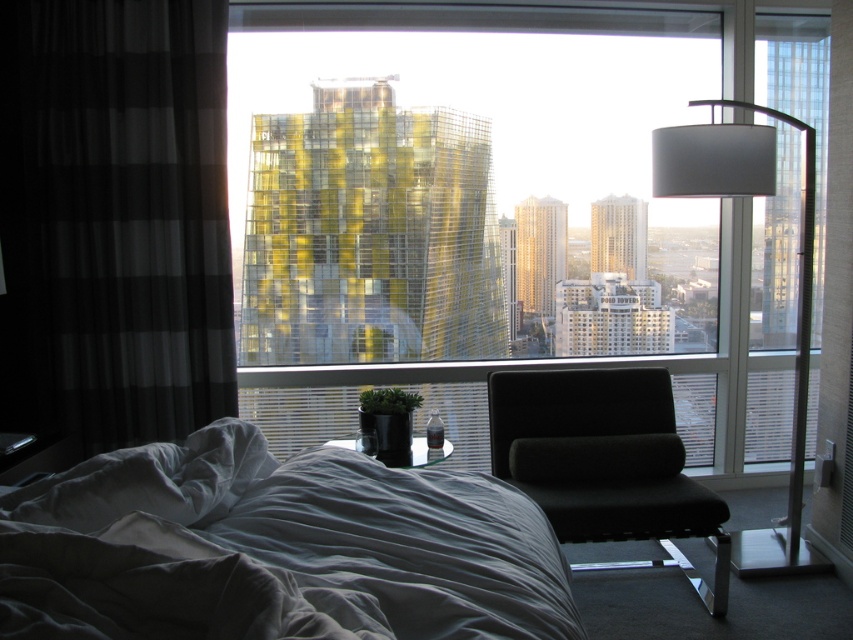
Question: Which point is closer to the camera?

Choices:
 (A) black checkered curtain at left
 (B) matte gray lamp at right
 (C) gray cotton bed at lower left

Answer: (C)

Question: Which point appears farthest from the camera in this image?

Choices:
 (A) (96, 552)
 (B) (86, 246)
 (C) (674, 564)
 (D) (244, 150)

Answer: (D)

Question: Does black checkered curtain at left appear on the left side of gray cotton bed at lower left?

Choices:
 (A) no
 (B) yes

Answer: (B)

Question: Does black fabric swivel chair at center appear on the left side of matte gray lamp at right?

Choices:
 (A) no
 (B) yes

Answer: (B)

Question: Can you confirm if black checkered curtain at left is smaller than black fabric swivel chair at center?

Choices:
 (A) yes
 (B) no

Answer: (B)

Question: Which point is farther to the camera?

Choices:
 (A) black fabric swivel chair at center
 (B) transparent glass window at center
 (C) matte gray lamp at right

Answer: (B)